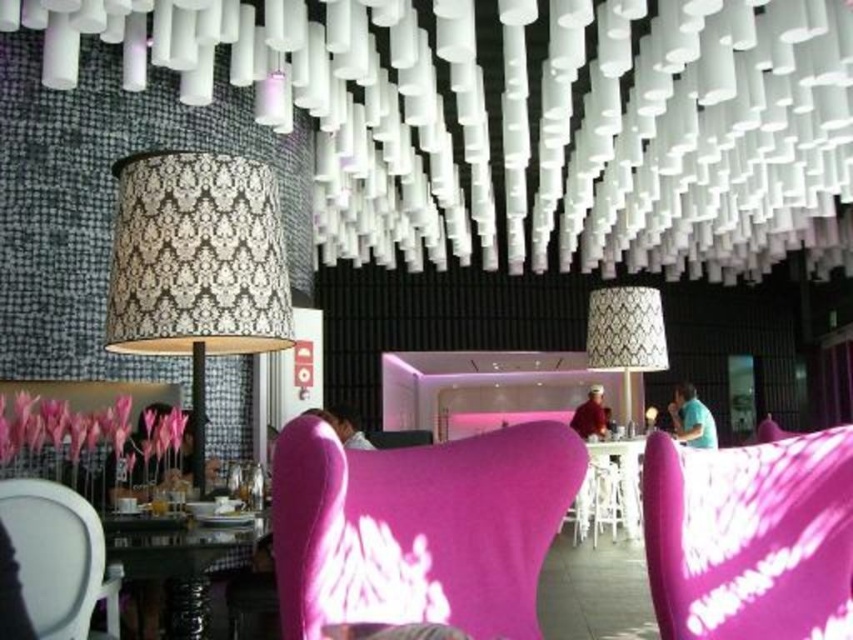
Which is in front, point (265, 317) or point (656, 308)?

Point (265, 317)

In order to click on patterned fabric lampshade at left in this screenshot , I will do `click(196, 266)`.

I want to click on patterned fabric lampshade at left, so click(196, 266).

Which of these two, matte pink fabric armchair at center or glassy black table at lower left, stands taller?

glassy black table at lower left is taller.

Can you confirm if matte pink fabric armchair at center is positioned below glassy black table at lower left?

Actually, matte pink fabric armchair at center is above glassy black table at lower left.

The width and height of the screenshot is (853, 640). I want to click on matte pink fabric armchair at center, so click(750, 538).

Locate an element on the screen. This screenshot has width=853, height=640. matte pink fabric armchair at center is located at coordinates (750, 538).

Can you confirm if white matte chandelier at upper center is positioned above patterned fabric lampshade at left?

Yes.

Does white matte chandelier at upper center have a greater width compared to patterned fabric lampshade at left?

Yes, white matte chandelier at upper center is wider than patterned fabric lampshade at left.

Is point (502, 0) behind point (215, 316)?

That is True.

Locate an element on the screen. Image resolution: width=853 pixels, height=640 pixels. white matte chandelier at upper center is located at coordinates (526, 122).